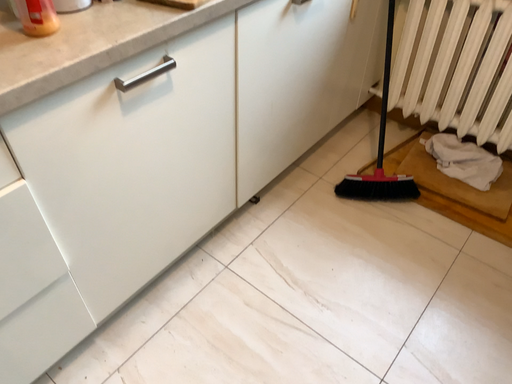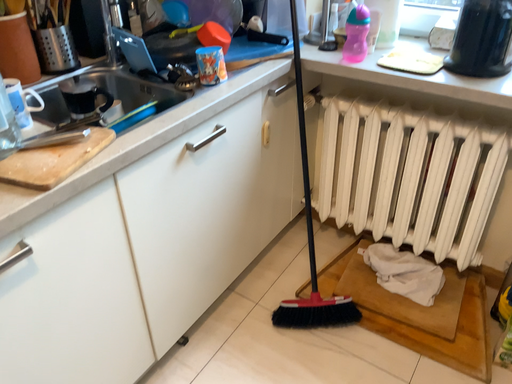
Question: How did the camera likely rotate when shooting the video?

Choices:
 (A) rotated upward
 (B) rotated downward

Answer: (A)